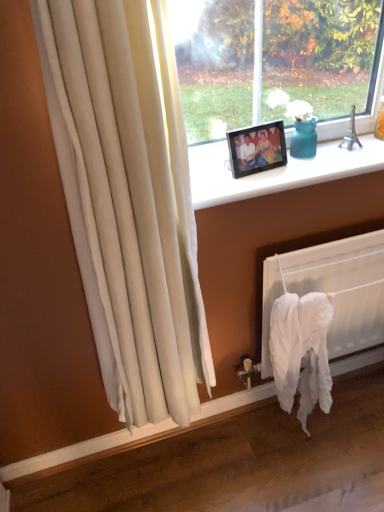
This screenshot has width=384, height=512. What do you see at coordinates (257, 148) in the screenshot?
I see `black plastic picture frame at upper center` at bounding box center [257, 148].

Locate an element on the screen. The height and width of the screenshot is (512, 384). white fabric at lower right is located at coordinates (332, 290).

Based on the photo, between white fabric at lower right and black plastic frame at upper center, which one has smaller width?

white fabric at lower right.

From a real-world perspective, is white fabric at lower right located higher than black plastic frame at upper center?

No, from a real-world perspective, white fabric at lower right is not above black plastic frame at upper center.

In the image, is white fabric at lower right on the left side or the right side of black plastic frame at upper center?

In the image, white fabric at lower right appears on the right side of black plastic frame at upper center.

Considering the relative sizes of white fabric at lower right and black plastic frame at upper center in the image provided, is white fabric at lower right shorter than black plastic frame at upper center?

Incorrect, the height of white fabric at lower right does not fall short of that of black plastic frame at upper center.

How many degrees apart are the facing directions of white fabric at lower right and black plastic picture frame at upper center?

The facing directions of white fabric at lower right and black plastic picture frame at upper center are 10.9 degrees apart.

Is white fabric at lower right with black plastic picture frame at upper center?

white fabric at lower right and black plastic picture frame at upper center are not in contact.

Can black plastic picture frame at upper center be found inside white fabric at lower right?

No, white fabric at lower right does not contain black plastic picture frame at upper center.

Which is more to the right, white fabric at lower right or black plastic picture frame at upper center?

white fabric at lower right.

Which is in front, black plastic frame at upper center or white fabric at lower right?

Positioned in front is black plastic frame at upper center.

From the image's perspective, between black plastic frame at upper center and white fabric at lower right, which one is located above?

From the image's view, black plastic frame at upper center is above.

Which is more to the left, black plastic frame at upper center or white fabric at lower right?

black plastic frame at upper center.

Can you see black plastic frame at upper center touching black plastic picture frame at upper center?

No, black plastic frame at upper center is not beside black plastic picture frame at upper center.

From a real-world perspective, who is located higher, black plastic frame at upper center or black plastic picture frame at upper center?

black plastic picture frame at upper center is physically above.

From their relative heights in the image, would you say black plastic frame at upper center is taller or shorter than black plastic picture frame at upper center?

Considering their sizes, black plastic frame at upper center has less height than black plastic picture frame at upper center.

From a real-world perspective, is black plastic picture frame at upper center below white fabric at lower right?

Actually, black plastic picture frame at upper center is physically above white fabric at lower right in the real world.

Can you confirm if black plastic picture frame at upper center is smaller than white fabric at lower right?

Yes.

Is black plastic picture frame at upper center directly adjacent to white fabric at lower right?

black plastic picture frame at upper center and white fabric at lower right are not in contact.

Considering the sizes of objects black plastic picture frame at upper center and white fabric at lower right in the image provided, who is taller, black plastic picture frame at upper center or white fabric at lower right?

white fabric at lower right.

Considering the sizes of objects black plastic picture frame at upper center and black plastic frame at upper center in the image provided, who is wider, black plastic picture frame at upper center or black plastic frame at upper center?

black plastic frame at upper center is wider.

Can you confirm if black plastic picture frame at upper center is smaller than black plastic frame at upper center?

Yes.

Which is further, (x=251, y=154) or (x=227, y=180)?

The point (x=251, y=154) is farther.

I want to click on window sill that is in front of the white fabric at lower right, so click(276, 170).

The width and height of the screenshot is (384, 512). Find the location of `radiator behind the black plastic picture frame at upper center`. radiator behind the black plastic picture frame at upper center is located at coordinates (332, 290).

Looking at the image, which one is located further to white fabric at lower right, black plastic picture frame at upper center or black plastic frame at upper center?

black plastic picture frame at upper center is further to white fabric at lower right.

Based on their spatial positions, is white fabric at lower right or black plastic picture frame at upper center further from black plastic frame at upper center?

The object further to black plastic frame at upper center is white fabric at lower right.

Estimate the real-world distances between objects in this image. Which object is closer to white fabric at lower right, black plastic frame at upper center or black plastic picture frame at upper center?

black plastic frame at upper center lies closer to white fabric at lower right than the other object.

Based on their spatial positions, is black plastic frame at upper center or white fabric at lower right closer to black plastic picture frame at upper center?

Based on the image, black plastic frame at upper center appears to be nearer to black plastic picture frame at upper center.

Estimate the real-world distances between objects in this image. Which object is further from black plastic picture frame at upper center, white fabric at lower right or black plastic frame at upper center?

white fabric at lower right lies further to black plastic picture frame at upper center than the other object.

Based on their spatial positions, is black plastic picture frame at upper center or white fabric at lower right closer to black plastic frame at upper center?

The object closer to black plastic frame at upper center is black plastic picture frame at upper center.

Find the location of a particular element. window sill between black plastic picture frame at upper center and white fabric at lower right in the vertical direction is located at coordinates (276, 170).